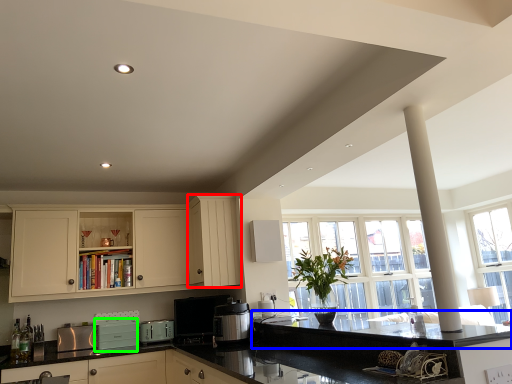
Question: Which object is positioned farthest from cabinetry (highlighted by a red box)? Select from countertop (highlighted by a blue box) and appliance (highlighted by a green box).

Choices:
 (A) countertop
 (B) appliance

Answer: (B)